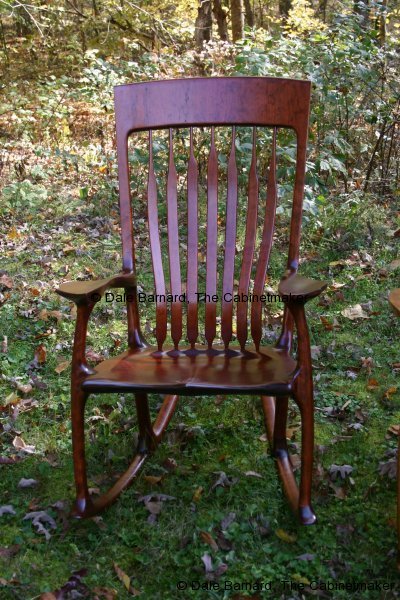
The height and width of the screenshot is (600, 400). What are the coordinates of `right rocker of rocking chair` in the screenshot? It's located at (116, 486).